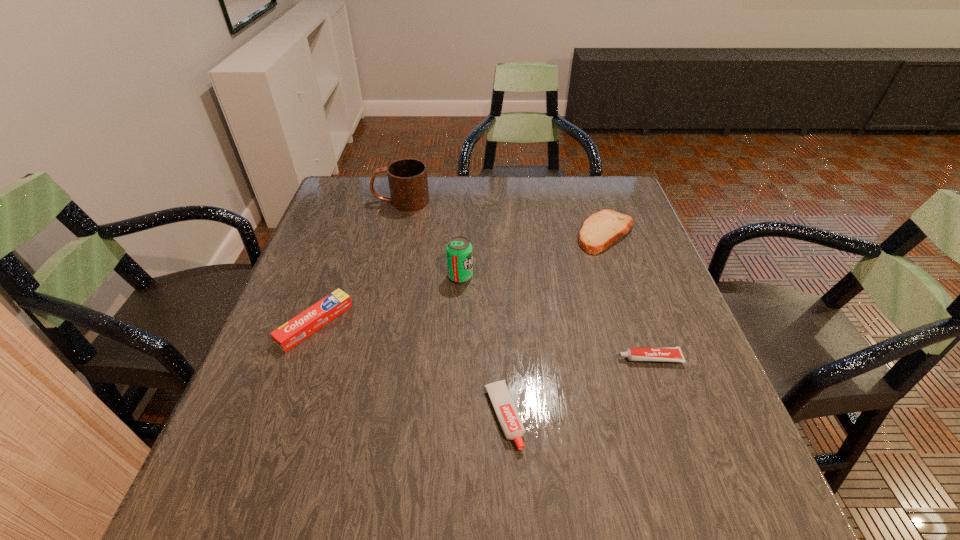
At what (x,y) coordinates should I click in order to perform the action: click on free point located on the left of the second farthest object. Please return your answer as a coordinate pair (x, y). Looking at the image, I should click on (540, 234).

Locate an element on the screen. This screenshot has height=540, width=960. free space located on the back of the leftmost toothpaste is located at coordinates (334, 272).

Where is `vacant space positioned on the left of the nearest object`? The image size is (960, 540). vacant space positioned on the left of the nearest object is located at coordinates (349, 416).

Locate an element on the screen. free region located 0.150m at the nozzle of the rightmost toothpaste is located at coordinates (545, 359).

You are a GUI agent. You are given a task and a screenshot of the screen. Output one action in this format:
    pyautogui.click(x=<x>, y=<y>)
    Task: Click on the vacant region located at the nozzle of the rightmost toothpaste
    
    Given the screenshot: What is the action you would take?
    pyautogui.click(x=492, y=359)

This screenshot has height=540, width=960. Identify the location of free space located 0.240m at the nozzle of the rightmost toothpaste. (502, 359).

Locate an element on the screen. This screenshot has height=540, width=960. mug located in the far edge section of the desktop is located at coordinates 408,182.

At what (x,y) coordinates should I click in order to perform the action: click on pita bread at the far edge. Please return your answer as a coordinate pair (x, y). Image resolution: width=960 pixels, height=540 pixels. Looking at the image, I should click on (602, 229).

Find the location of a particular element. The height and width of the screenshot is (540, 960). mug at the left edge is located at coordinates (x=408, y=182).

The image size is (960, 540). In order to click on toothpaste situated at the left edge in this screenshot , I will do `click(294, 331)`.